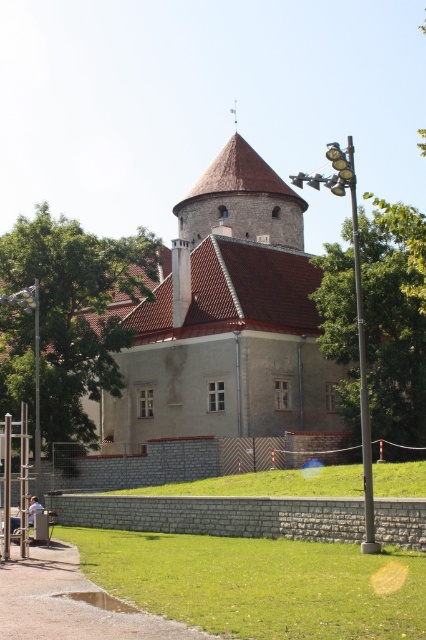
Between gray stone castle at center and green grass at lower center, which one appears on the left side from the viewer's perspective?

Positioned to the left is green grass at lower center.

Can you confirm if gray stone castle at center is wider than green grass at lower center?

Correct, the width of gray stone castle at center exceeds that of green grass at lower center.

Identify the location of gray stone castle at center. 227,321.

In order to click on gray stone castle at center in this screenshot , I will do `click(227, 321)`.